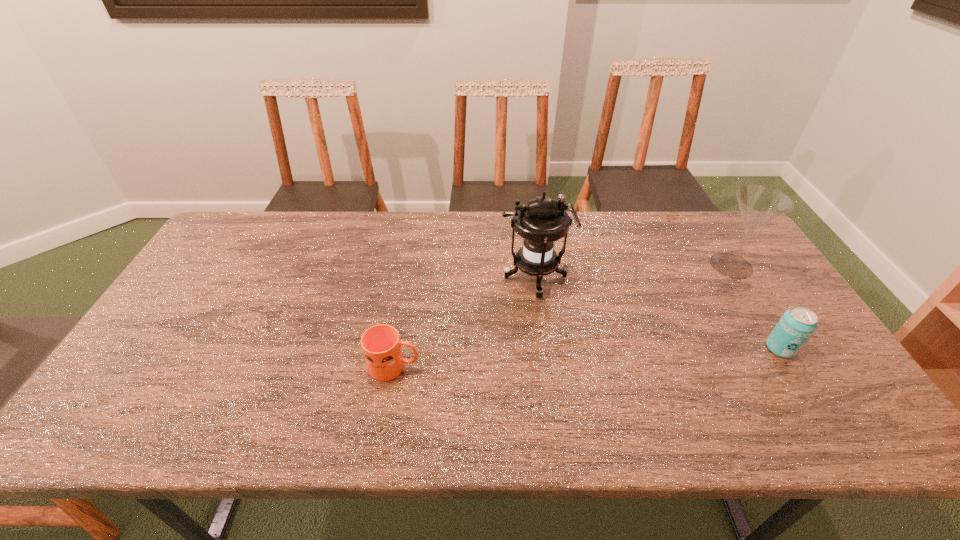
Identify the location of flute glass present at the right edge. (759, 205).

Locate an element on the screen. This screenshot has height=540, width=960. beer can that is at the right edge is located at coordinates (796, 326).

Where is `object that is at the far right corner`? object that is at the far right corner is located at coordinates (759, 205).

In the image, there is a desktop. Identify the location of vacant space at the far edge. (366, 220).

Find the location of a particular element. The height and width of the screenshot is (540, 960). vacant space at the near edge is located at coordinates 195,406.

Where is `free space at the left edge`? free space at the left edge is located at coordinates (194, 301).

Locate an element on the screen. This screenshot has width=960, height=540. vacant space at the far left corner is located at coordinates click(247, 242).

Where is `free space at the near left corner`? The width and height of the screenshot is (960, 540). free space at the near left corner is located at coordinates (114, 438).

Where is `vacant point located between the beer can and the mug`? The height and width of the screenshot is (540, 960). vacant point located between the beer can and the mug is located at coordinates coord(588,357).

I want to click on unoccupied area between the tallest object and the flute glass, so click(633, 272).